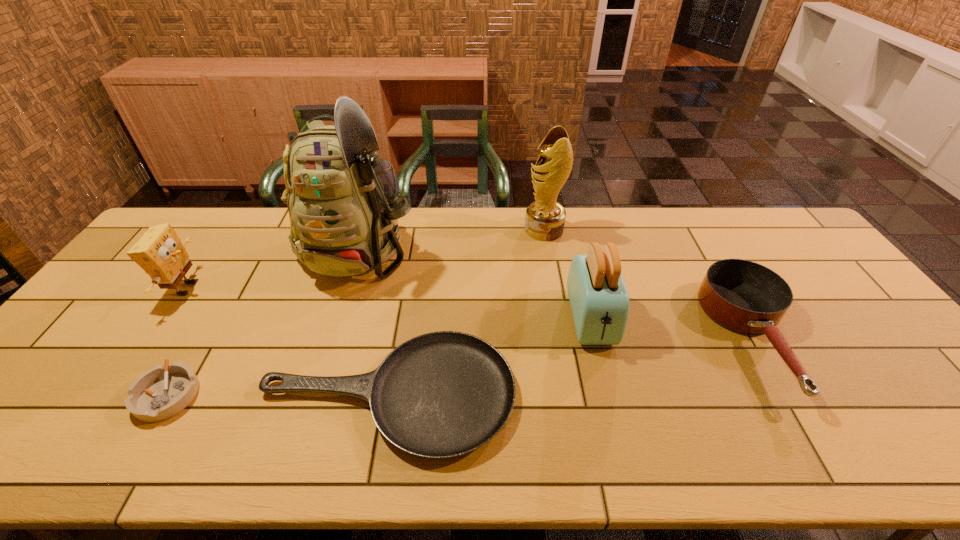
Locate an element on the screen. Image resolution: width=960 pixels, height=540 pixels. backpack is located at coordinates (343, 204).

Where is `the second tallest object`? The image size is (960, 540). the second tallest object is located at coordinates (545, 218).

At what (x,y) coordinates should I click in order to perform the action: click on toaster. Please return your answer as a coordinate pair (x, y). This screenshot has height=540, width=960. Looking at the image, I should click on (599, 300).

The height and width of the screenshot is (540, 960). In order to click on the fourth shortest object in this screenshot , I will do `click(159, 252)`.

Identify the location of the leftmost object. The image size is (960, 540). (159, 252).

Where is `the third shortest object`? The width and height of the screenshot is (960, 540). the third shortest object is located at coordinates (744, 296).

Where is `the rightmost object`? This screenshot has height=540, width=960. the rightmost object is located at coordinates (744, 296).

At what (x,y) coordinates should I click in order to perform the action: click on the sixth tallest object. Please return your answer as a coordinate pair (x, y). This screenshot has height=540, width=960. Looking at the image, I should click on (161, 392).

Locate an element on the screen. the sixth object from right to left is located at coordinates (161, 392).

Locate an element on the screen. frying pan is located at coordinates (442, 394).